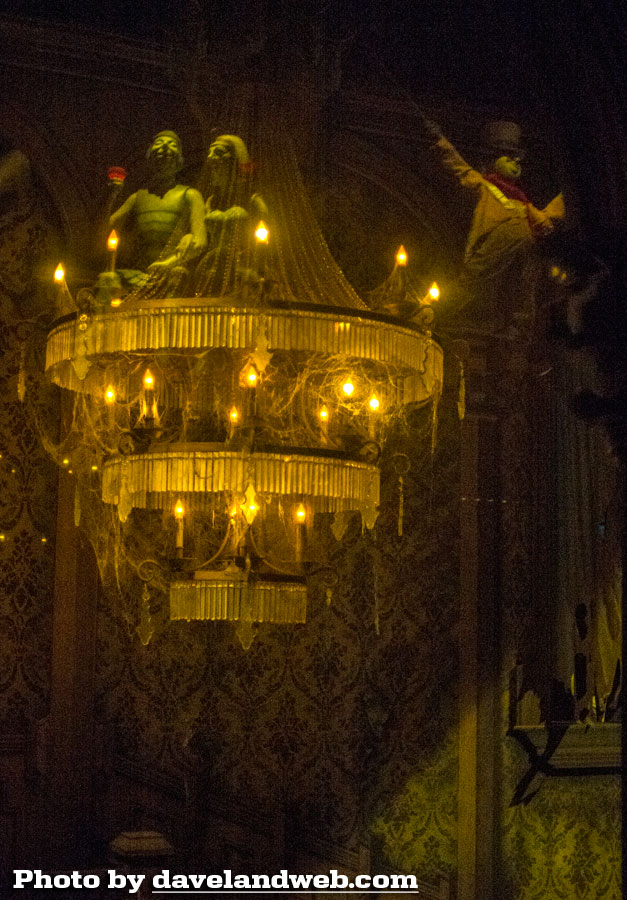
Where is `red mug`? red mug is located at coordinates (118, 172).